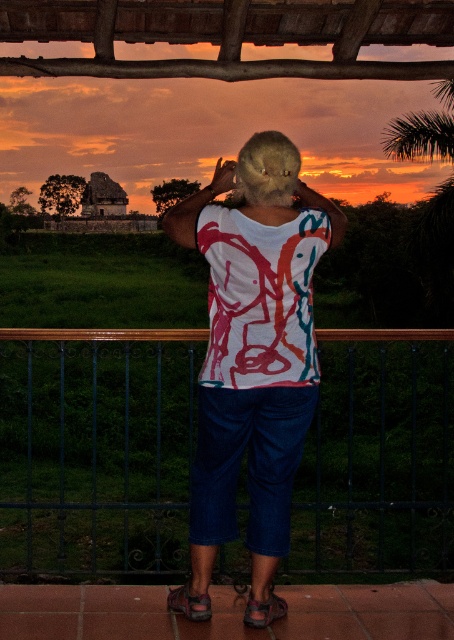
Question: Considering the relative positions of metallic blue fence at lower center and white printed shirt at center in the image provided, where is metallic blue fence at lower center located with respect to white printed shirt at center?

Choices:
 (A) below
 (B) above

Answer: (A)

Question: Does metallic blue fence at lower center appear under fuzzy brown head at center?

Choices:
 (A) yes
 (B) no

Answer: (A)

Question: Which object is positioned closest to the metallic blue fence at lower center?

Choices:
 (A) white printed shirt at center
 (B) fuzzy brown head at center

Answer: (B)

Question: Which object is farther from the camera taking this photo?

Choices:
 (A) fuzzy brown head at center
 (B) metallic blue fence at lower center
 (C) white printed shirt at center

Answer: (B)

Question: Estimate the real-world distances between objects in this image. Which object is closer to the metallic blue fence at lower center?

Choices:
 (A) white printed shirt at center
 (B) fuzzy brown head at center

Answer: (B)

Question: Is white printed shirt at center positioned at the back of fuzzy brown head at center?

Choices:
 (A) yes
 (B) no

Answer: (B)